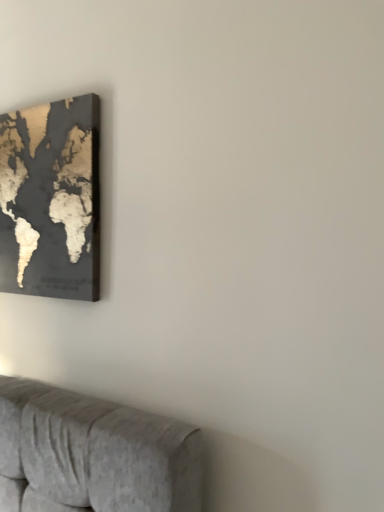
At what (x,y) coordinates should I click in order to perform the action: click on gold leaf map at upper left. Please return your answer as a coordinate pair (x, y). The image size is (384, 512). Looking at the image, I should click on coord(51,200).

The height and width of the screenshot is (512, 384). What do you see at coordinates (51, 200) in the screenshot? I see `gold leaf map at upper left` at bounding box center [51, 200].

This screenshot has height=512, width=384. I want to click on gold leaf map at upper left, so click(x=51, y=200).